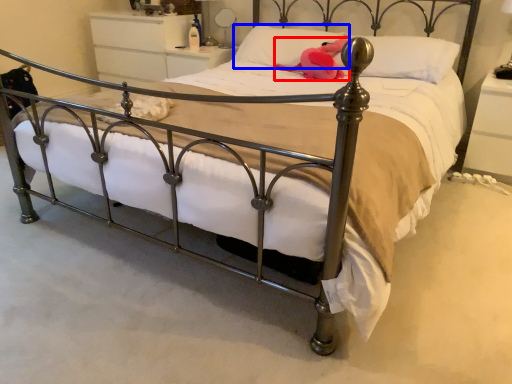
Question: Which object is further to the camera taking this photo, animal (highlighted by a red box) or pillow (highlighted by a blue box)?

Choices:
 (A) animal
 (B) pillow

Answer: (B)